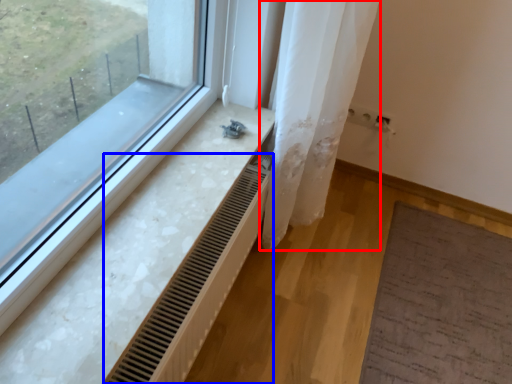
Question: Which object appears farthest to the camera in this image, shower curtain (highlighted by a red box) or radiator (highlighted by a blue box)?

Choices:
 (A) shower curtain
 (B) radiator

Answer: (A)